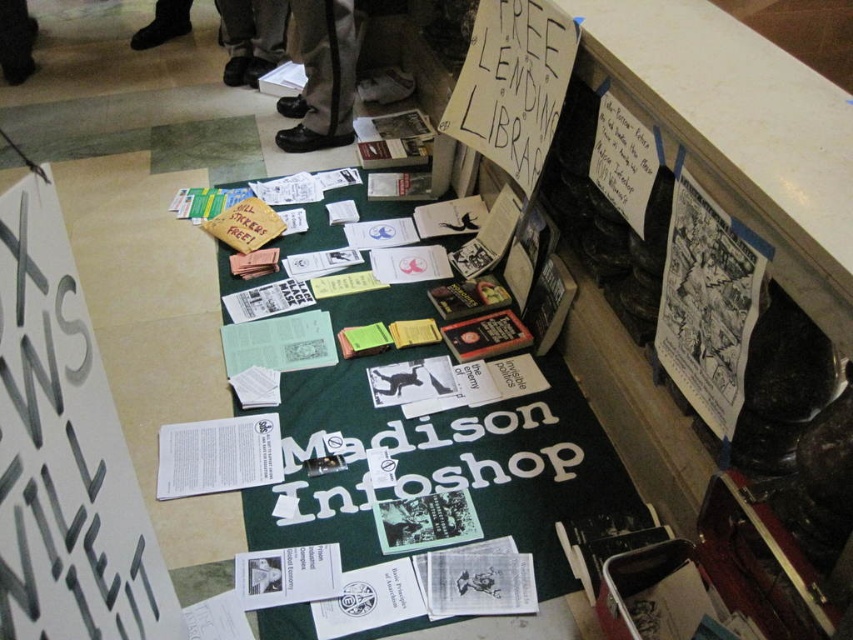
Does point (51, 589) come farther from viewer compared to point (350, 32)?

No, (51, 589) is in front of (350, 32).

In the scene shown: Which is more to the left, white paper at lower left or black leather shoes at upper center?

black leather shoes at upper center

Measure the distance between point (83, 317) and camera.

Point (83, 317) is 87.05 centimeters from camera.

You are a GUI agent. You are given a task and a screenshot of the screen. Output one action in this format:
    pyautogui.click(x=<x>, y=<y>)
    Task: Click on the white paper at lower left
    The height and width of the screenshot is (640, 853).
    Given the screenshot: What is the action you would take?
    pyautogui.click(x=64, y=452)

Between green paper at center and white paper at lower left, which one has more height?

green paper at center

Can you confirm if green paper at center is shorter than white paper at lower left?

Incorrect, green paper at center's height does not fall short of white paper at lower left's.

This screenshot has width=853, height=640. What do you see at coordinates (444, 465) in the screenshot? I see `green paper at center` at bounding box center [444, 465].

Where is `green paper at center`? The image size is (853, 640). green paper at center is located at coordinates (444, 465).

Is green paper at center to the left of black leather shoes at upper center from the viewer's perspective?

In fact, green paper at center is to the right of black leather shoes at upper center.

Based on the photo, between green paper at center and black leather shoes at upper center, which one has more height?

Standing taller between the two is green paper at center.

Does point (537, 397) lie behind point (306, 65)?

No.

Find the location of a particular element. Image resolution: width=853 pixels, height=640 pixels. green paper at center is located at coordinates (444, 465).